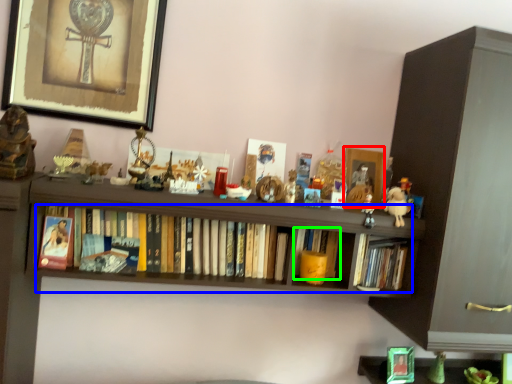
Question: Which object is positioned farthest from picture frame (highlighted by a red box)? Select from book (highlighted by a blue box) and book (highlighted by a green box).

Choices:
 (A) book
 (B) book

Answer: (A)